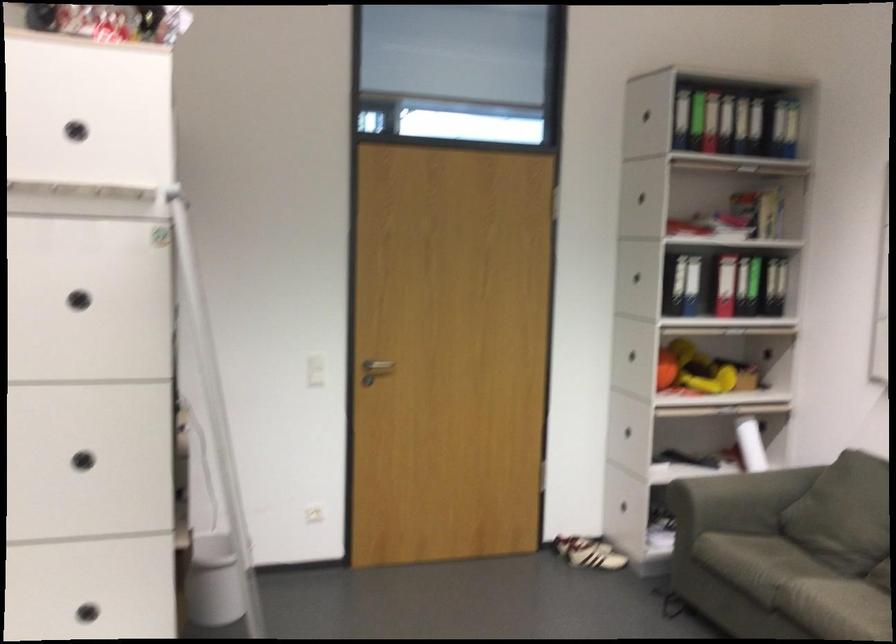
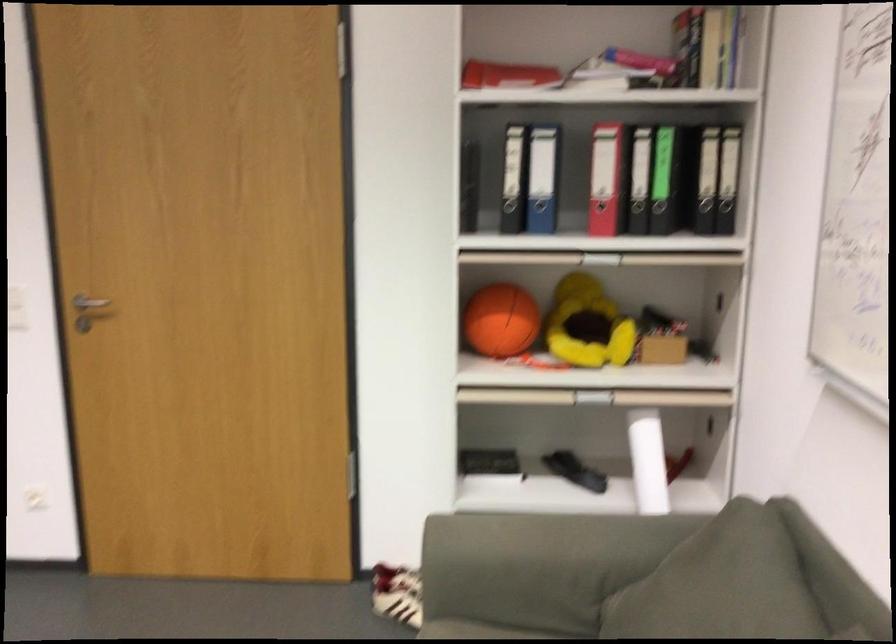
Locate, in the second image, the point that corresponds to (x=753, y=442) in the first image.

(648, 460)